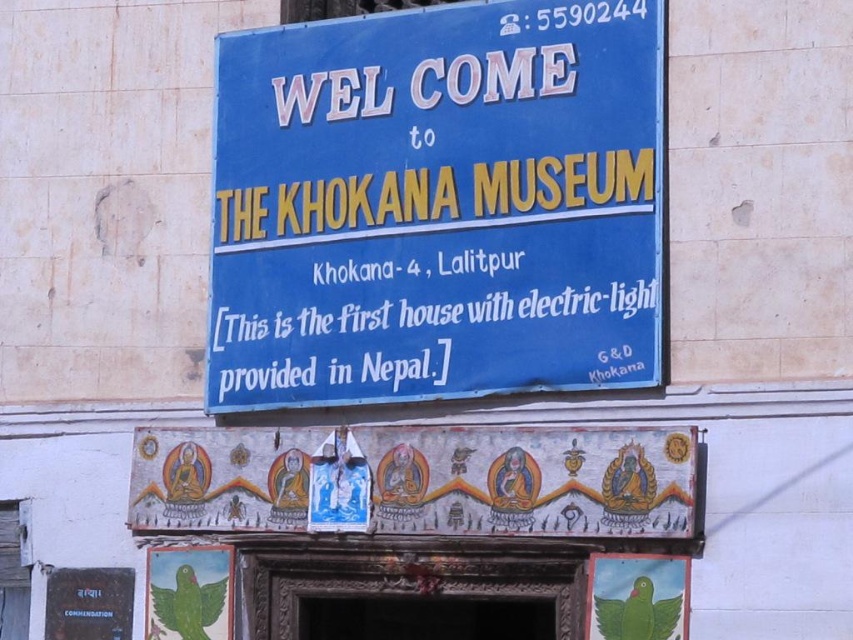
You are a visitor standing at the entrance of The Khokana Museum. You see the blue plastic sign at upper center and the painted wood banner at center. Which object is narrower?

The blue plastic sign at upper center is thinner than the painted wood banner at center, so the blue plastic sign at upper center is narrower.

You are standing in front of the museum entrance. You see the blue plastic sign at upper center and the painted wood banner at center. Which object is located to the right of the other?

The blue plastic sign at upper center is positioned on the right side of painted wood banner at center.